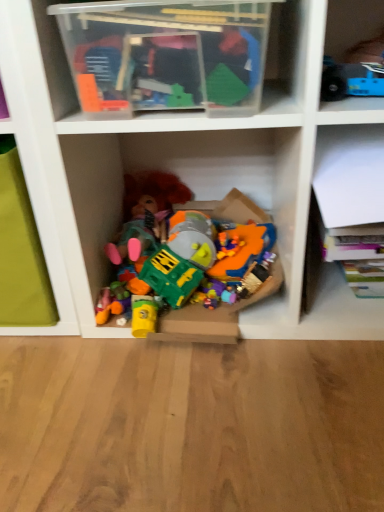
Question: Does transparent plastic container at upper center, the second shelf from the right, have a greater width compared to blue plastic toy at upper right, the 1th toy in the right-to-left sequence?

Choices:
 (A) no
 (B) yes

Answer: (B)

Question: From the image's perspective, is transparent plastic container at upper center, the second shelf from the bottom, below blue plastic toy at upper right, the 1th toy from the front?

Choices:
 (A) yes
 (B) no

Answer: (B)

Question: Considering the relative positions of transparent plastic container at upper center, the second shelf from the bottom, and blue plastic toy at upper right, marked as the 2th toy in a left-to-right arrangement, in the image provided, is transparent plastic container at upper center, the second shelf from the bottom, to the right of blue plastic toy at upper right, marked as the 2th toy in a left-to-right arrangement, from the viewer's perspective?

Choices:
 (A) yes
 (B) no

Answer: (B)

Question: Considering the relative sizes of transparent plastic container at upper center, which appears as the 1th shelf when viewed from the top, and blue plastic toy at upper right, the 1th toy from the front, in the image provided, is transparent plastic container at upper center, which appears as the 1th shelf when viewed from the top, thinner than blue plastic toy at upper right, the 1th toy from the front,?

Choices:
 (A) no
 (B) yes

Answer: (A)

Question: From the image's perspective, is transparent plastic container at upper center, marked as the first shelf in a left-to-right arrangement, on blue plastic toy at upper right, marked as the 2th toy in a left-to-right arrangement?

Choices:
 (A) no
 (B) yes

Answer: (B)

Question: Considering the relative positions of blue plastic toy at upper right, marked as the 2th toy in a left-to-right arrangement, and white paper at upper right, the 2th shelf positioned from the left, in the image provided, is blue plastic toy at upper right, marked as the 2th toy in a left-to-right arrangement, to the left or to the right of white paper at upper right, the 2th shelf positioned from the left,?

Choices:
 (A) left
 (B) right

Answer: (A)

Question: Based on their sizes in the image, would you say blue plastic toy at upper right, which appears as the second toy when viewed from the back, is bigger or smaller than white paper at upper right, the 2th shelf positioned from the left?

Choices:
 (A) big
 (B) small

Answer: (B)

Question: Does point (362, 71) appear closer or farther from the camera than point (364, 141)?

Choices:
 (A) closer
 (B) farther

Answer: (A)

Question: Is blue plastic toy at upper right, the second toy when ordered from bottom to top, inside or outside of white paper at upper right, which is the 1th shelf in right-to-left order?

Choices:
 (A) inside
 (B) outside

Answer: (B)

Question: In the image, is blue plastic toy at upper right, marked as the 2th toy in a left-to-right arrangement, on the left side or the right side of plastic toys at center, the first toy when ordered from bottom to top?

Choices:
 (A) right
 (B) left

Answer: (A)

Question: In terms of height, does blue plastic toy at upper right, the 1th toy from the front, look taller or shorter compared to plastic toys at center, the 1th toy in the back-to-front sequence?

Choices:
 (A) tall
 (B) short

Answer: (B)

Question: From the image's perspective, is blue plastic toy at upper right, the second toy when ordered from bottom to top, positioned above or below plastic toys at center, acting as the second toy starting from the right?

Choices:
 (A) below
 (B) above

Answer: (B)

Question: Is blue plastic toy at upper right, which appears as the second toy when viewed from the back, bigger or smaller than plastic toys at center, the 1th toy in the back-to-front sequence?

Choices:
 (A) big
 (B) small

Answer: (B)

Question: Is white paper at upper right, arranged as the first shelf when ordered from the bottom, wider or thinner than plastic toys at center, which is the 2th toy from top to bottom?

Choices:
 (A) thin
 (B) wide

Answer: (B)

Question: Relative to plastic toys at center, the 1th toy in the back-to-front sequence, is white paper at upper right, arranged as the first shelf when ordered from the bottom, in front or behind?

Choices:
 (A) front
 (B) behind

Answer: (A)